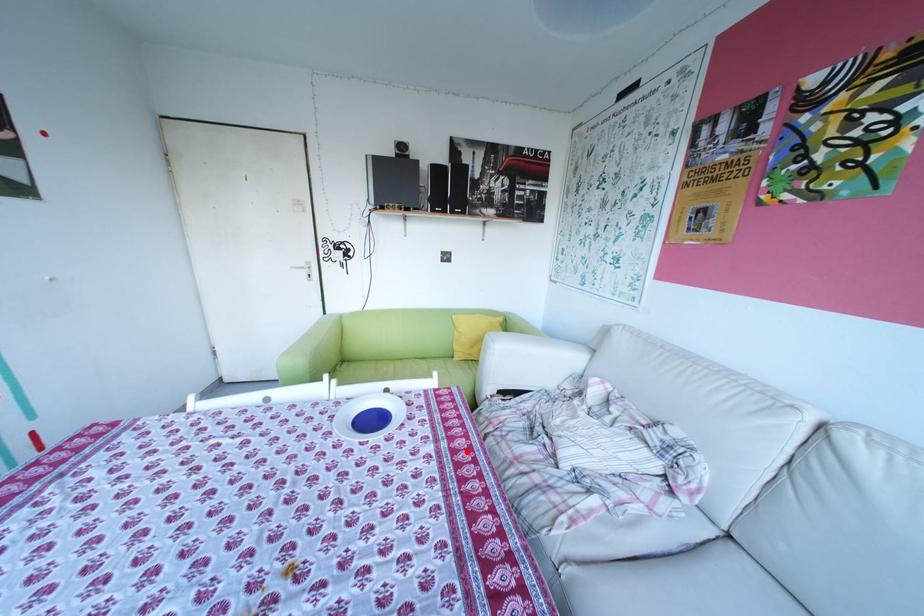
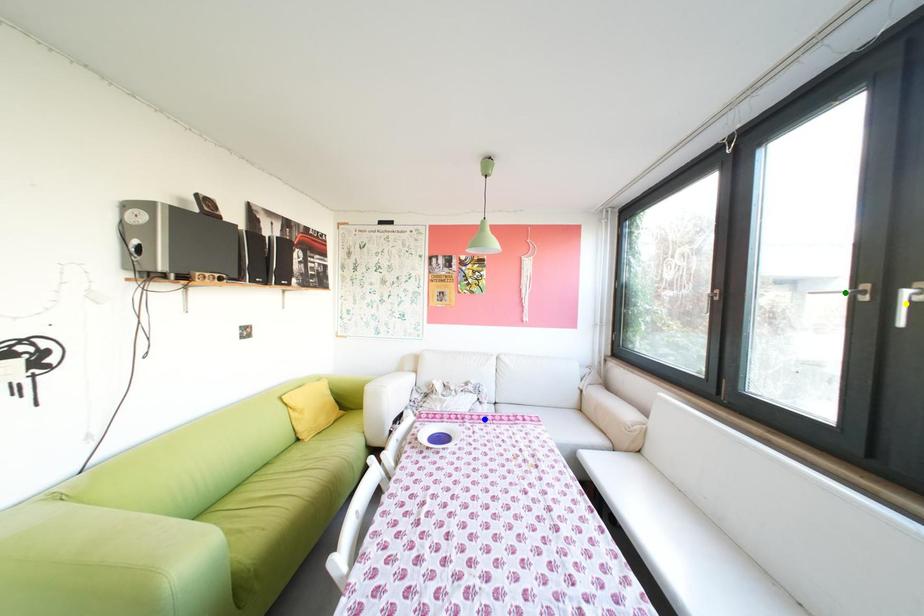
Question: I am providing you with two images of the same scene from different viewpoints. A red point is marked on the first image. You are given multiple points on the second image. In image 2, which mark is for the same physical point as the one in image 1?

Choices:
 (A) blue point
 (B) green point
 (C) yellow point

Answer: (A)